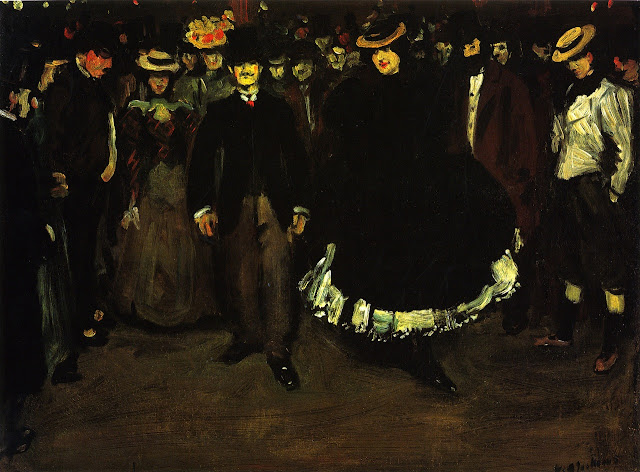
Locate an element on the screen. This screenshot has width=640, height=472. floor is located at coordinates (365, 423).